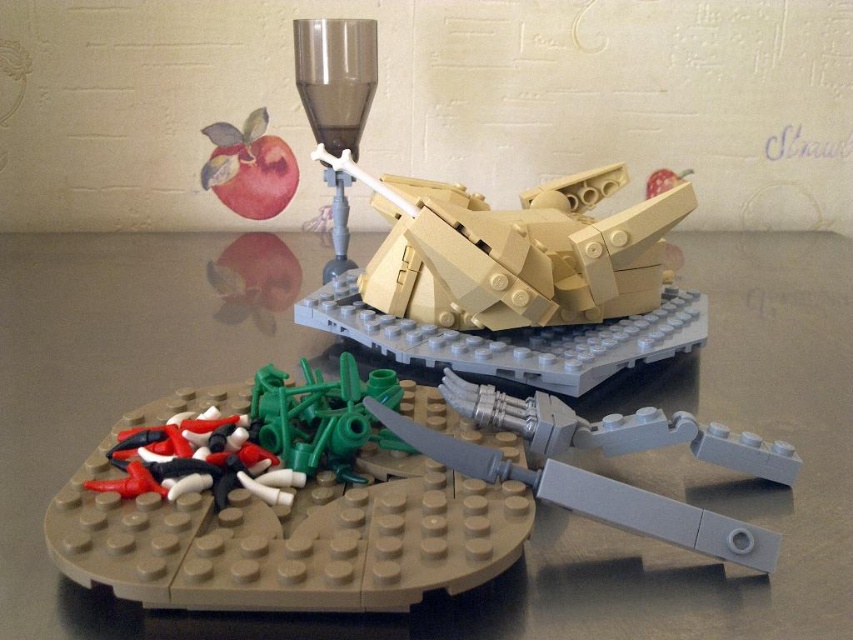
You are a LEGO builder standing 5 feet away from the camera. You want to reach the tan matte tank at center to add some accessories to it. Can you reach it without moving closer?

The tan matte tank at center is 31.07 inches away from the camera. Since you are 5 feet away, which is 60 inches, you are 28.93 inches away from the tank. Assuming an average human arm length of about 25 inches, you cannot reach the tan matte tank at center without moving closer.

You are a LEGO builder who needs to attach the matte red apple at upper left to the tan matte tank at center. Given that the distance between them is 1.02 meters, can you reach the apple from the tank without moving your position?

The tan matte tank at center and the matte red apple at upper left are 1.02 meters apart. Since the average human arm length is about 0.7 meters, you cannot reach the apple from the tank without moving your position.

You are setting up a still life arrangement with the brown matte table at center and the matte red apple at upper left. From the perspective of someone standing in front of the scene, which object is positioned to the right of the other?

The brown matte table at center is to the right of the matte red apple at upper left.